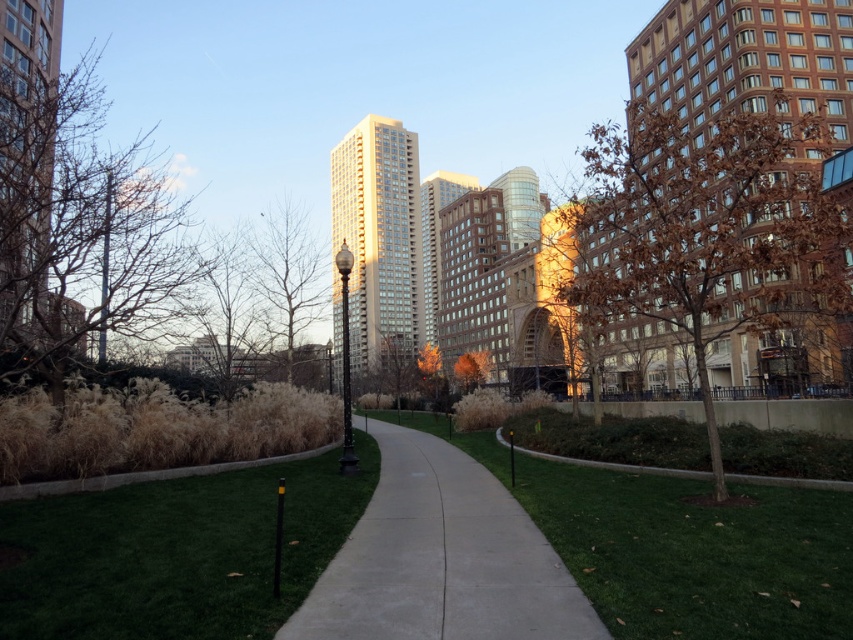
Question: Where is green grass at center located in relation to bare branches at left in the image?

Choices:
 (A) below
 (B) above

Answer: (A)

Question: Estimate the real-world distances between objects in this image. Which object is closer to the bare branches at left?

Choices:
 (A) bare branches at center
 (B) green grass at center
 (C) concrete at center

Answer: (B)

Question: Which of the following is the farthest from the observer?

Choices:
 (A) (462, 374)
 (B) (288, 218)

Answer: (A)

Question: Does green grass at center have a larger size compared to bare branches at center?

Choices:
 (A) no
 (B) yes

Answer: (A)

Question: Which point is closer to the camera taking this photo?

Choices:
 (A) (619, 204)
 (B) (74, 324)

Answer: (A)

Question: Is brown leafy tree at center-right to the left of orange leafy tree at center from the viewer's perspective?

Choices:
 (A) no
 (B) yes

Answer: (A)